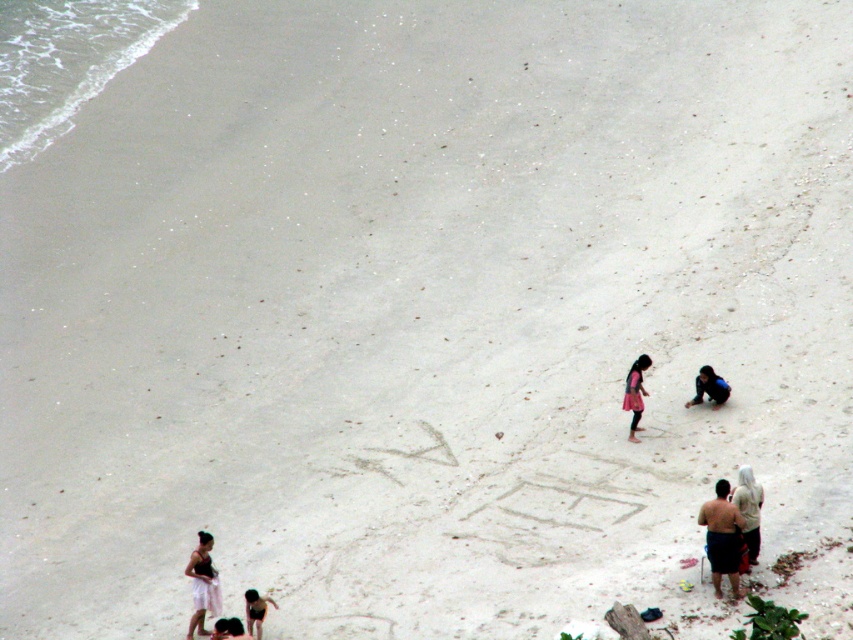
You are a beachgoer who wants to lay out your towel and fabric. Based on the scene, which object is taller between the white cotton towel at lower left and the dark blue fabric at lower right?

The white cotton towel at lower left is much taller than the dark blue fabric at lower right.

You are a photographer standing at the top of the beach looking down. You want to capture a photo that includes both the dark blue fabric at lower right and the smooth skin person at lower left. Which object should you focus on first to ensure both are in frame?

The dark blue fabric at lower right is bigger than the smooth skin person at lower left, so you should focus on the dark blue fabric at lower right first to ensure both are in frame.